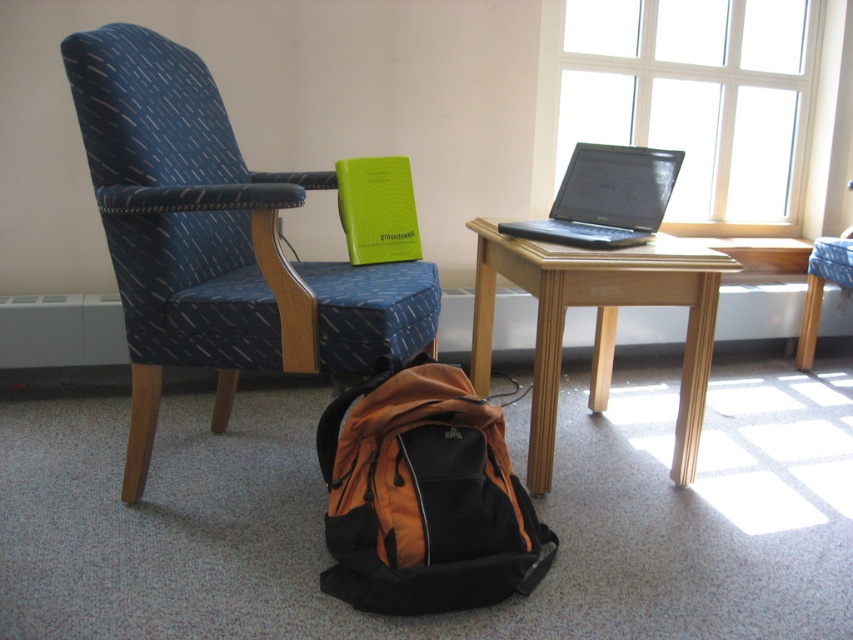
You are standing in the study area and want to determine the relative positions of two points marked on the floor. The first point is at coordinate point (138, 416) and the second is at coordinate point (815, 300). Which point is closer to you?

Point (138, 416) is closer to the viewer than point (815, 300).

You are organizing a small office space and need to place a 24 inch wide printer between the orange fabric backpack at lower center and the black glossy laptop at center. Can the printer fit in the space between them?

The distance between the orange fabric backpack at lower center and the black glossy laptop at center is 23.85 inches. Since the printer is 24 inches wide, it cannot fit in the space between them as the available space is slightly narrower than the printer.

Based on the photo, you are organizing a small party in the study area and need to place a decoration on top of the blue fabric armchair at left. Can you confirm if the orange fabric backpack at lower center can also be placed on the same chair without touching the decoration?

The blue fabric armchair at left is taller than the orange fabric backpack at lower center. Since the armchair is taller, there might be enough vertical space to place the decoration on top of the chair and the backpack underneath without them touching. However, this depends on the exact dimensions and how they are arranged.